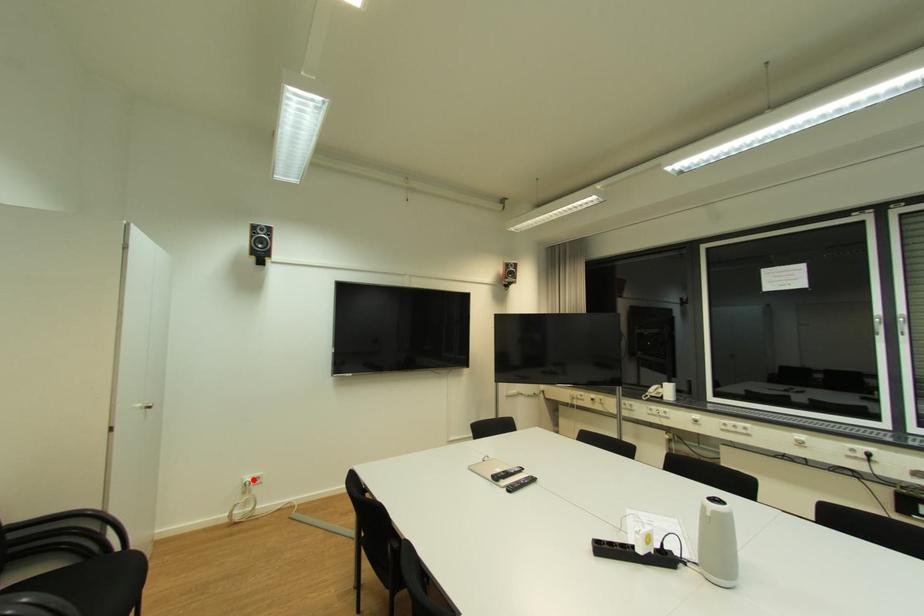
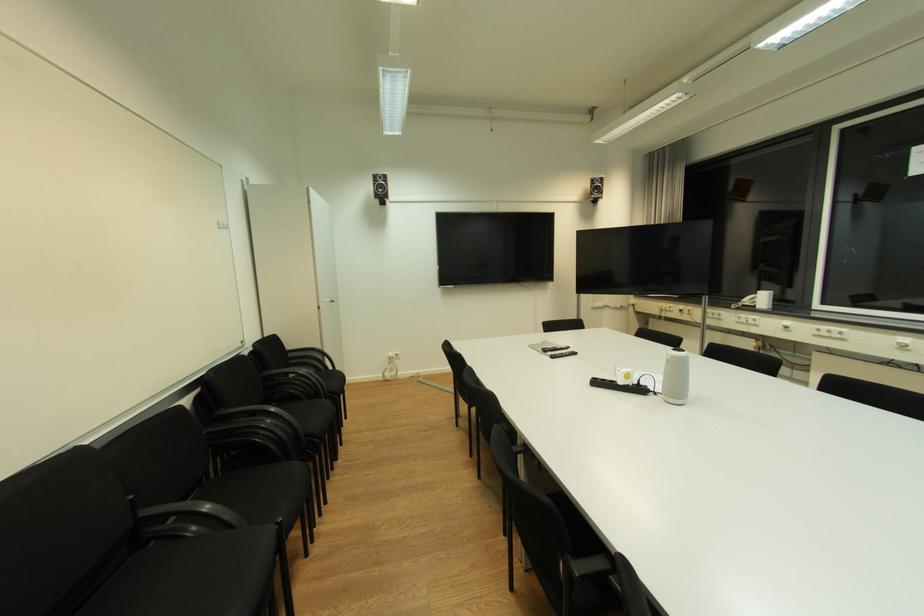
In the second image, find the point that corresponds to the highlighted location in the first image.

(396, 355)